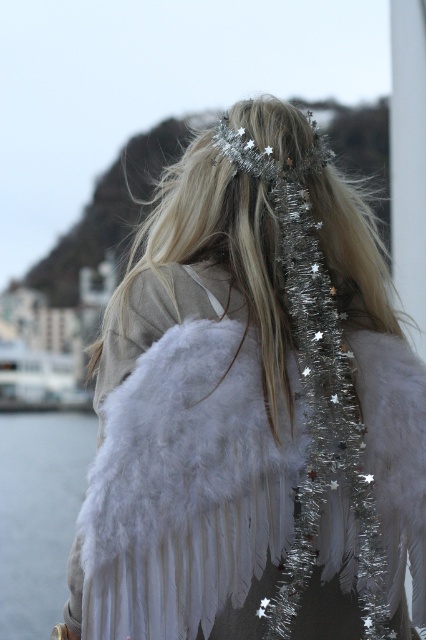
Question: Which point appears closest to the camera in this image?

Choices:
 (A) (28, 449)
 (B) (94, 547)

Answer: (B)

Question: Can you confirm if white feathered wings at center is positioned to the left of transparent water at lower left?

Choices:
 (A) no
 (B) yes

Answer: (A)

Question: Which point is closer to the camera?

Choices:
 (A) (40, 596)
 (B) (405, 392)

Answer: (B)

Question: Considering the relative positions of white feathered wings at center and transparent water at lower left in the image provided, where is white feathered wings at center located with respect to transparent water at lower left?

Choices:
 (A) below
 (B) above

Answer: (B)

Question: Which object is closer to the camera taking this photo?

Choices:
 (A) white feathered wings at center
 (B) transparent water at lower left

Answer: (A)

Question: Is white feathered wings at center thinner than transparent water at lower left?

Choices:
 (A) no
 (B) yes

Answer: (A)